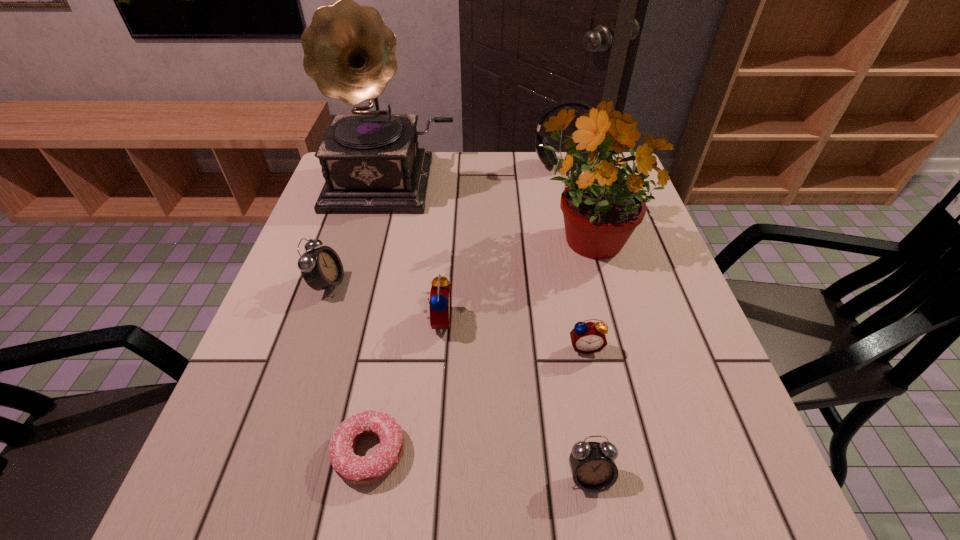
You are a GUI agent. You are given a task and a screenshot of the screen. Output one action in this format:
    pyautogui.click(x=<x>, y=<y>)
    Task: Click on the headset that is positioned at the right edge
    
    Given the screenshot: What is the action you would take?
    pyautogui.click(x=547, y=157)

This screenshot has width=960, height=540. I want to click on object present at the far left corner, so click(371, 161).

The height and width of the screenshot is (540, 960). What are the coordinates of `object located at the far right corner` in the screenshot? It's located at (547, 157).

Image resolution: width=960 pixels, height=540 pixels. I want to click on vacant position at the far edge of the desktop, so click(x=484, y=188).

In the image, there is a desktop. Where is `vacant region at the near edge`? Image resolution: width=960 pixels, height=540 pixels. vacant region at the near edge is located at coordinates (616, 494).

Where is `free space at the left edge of the desktop`? This screenshot has height=540, width=960. free space at the left edge of the desktop is located at coordinates (254, 368).

Locate an element on the screen. vacant space at the right edge of the desktop is located at coordinates (631, 307).

The height and width of the screenshot is (540, 960). What are the coordinates of `free space between the red flowerpot and the nearer white alarm clock` in the screenshot? It's located at (588, 356).

In order to click on vacant area that lies between the right white alarm clock and the right red alarm clock in this screenshot , I will do `click(587, 412)`.

This screenshot has height=540, width=960. Find the location of `empty space that is in between the right white alarm clock and the red flowerpot`. empty space that is in between the right white alarm clock and the red flowerpot is located at coordinates (588, 356).